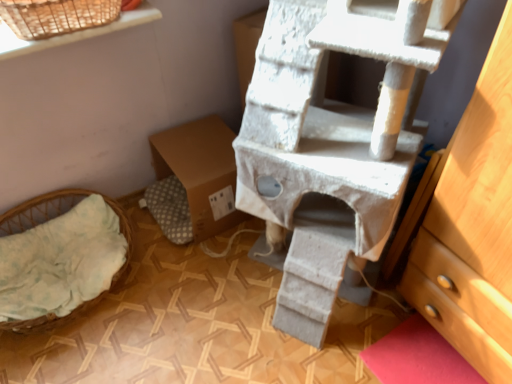
The width and height of the screenshot is (512, 384). Identify the location of vacant space that is in between light green fabric basket at lower left and brown cardboard box at center. (176, 247).